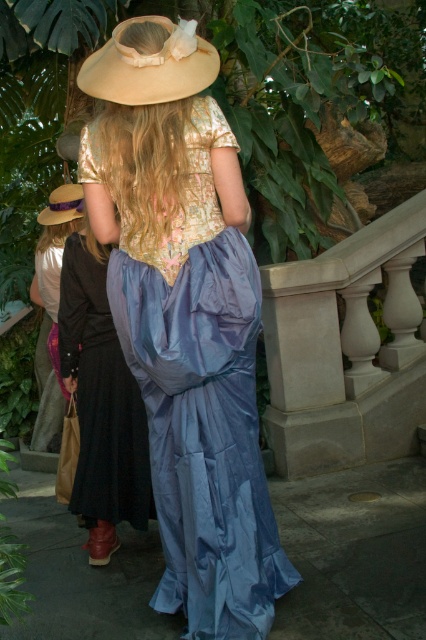
Question: From the image, what is the correct spatial relationship of shiny blue fabric dress at center in relation to matte blue dress at center?

Choices:
 (A) left
 (B) right

Answer: (B)

Question: Which object is closer to the camera taking this photo?

Choices:
 (A) beige fabric hat at upper center
 (B) matte black dress at left
 (C) matte blue dress at center

Answer: (A)

Question: Among these objects, which one is nearest to the camera?

Choices:
 (A) shiny blue fabric dress at center
 (B) beige fabric hat at upper center

Answer: (B)

Question: Considering the real-world distances, which object is closest to the matte black dress at left?

Choices:
 (A) matte blue dress at center
 (B) beige fabric hat at upper center
 (C) brown straw cowboy hat at upper left

Answer: (C)

Question: Is matte blue dress at center above matte black dress at left?

Choices:
 (A) yes
 (B) no

Answer: (B)

Question: Is beige fabric hat at upper center closer to camera compared to brown straw cowboy hat at upper left?

Choices:
 (A) yes
 (B) no

Answer: (A)